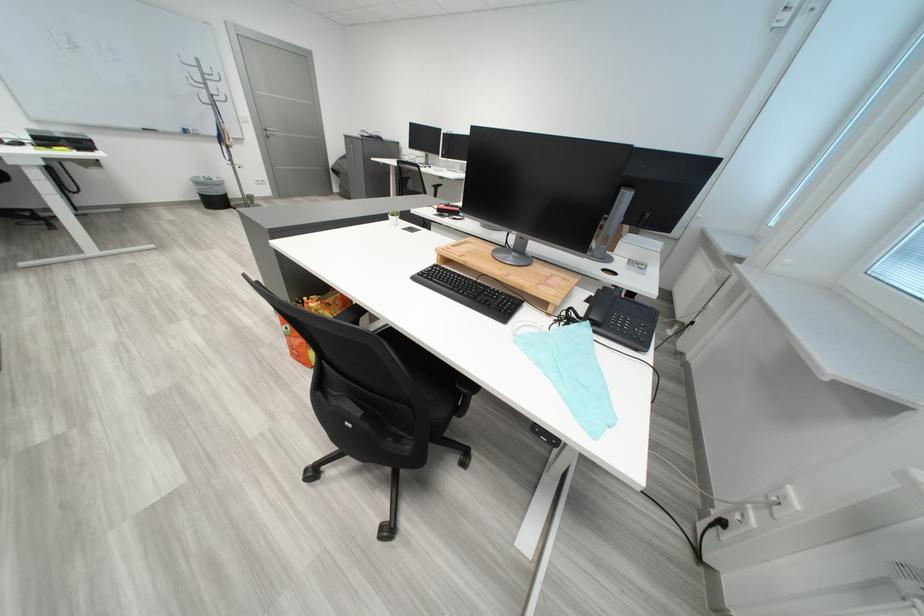
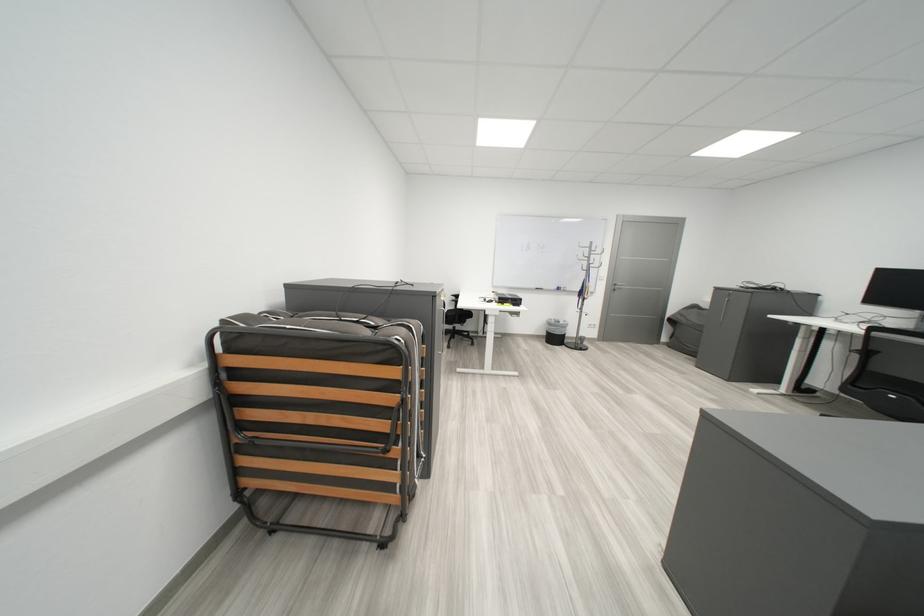
The point at [211,185] is marked in the first image. Where is the corresponding point in the second image?

(563, 326)